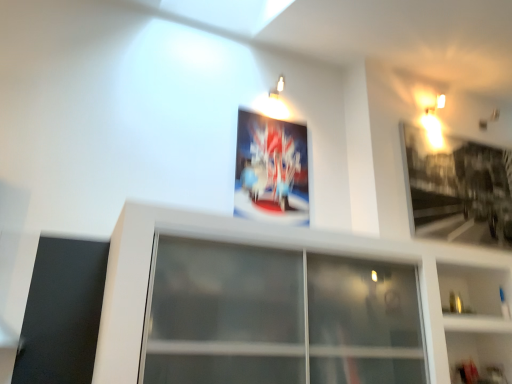
Measure the distance between metallic silver picture frame at upper right, which is the 2th picture frame in left-to-right order, and camera.

metallic silver picture frame at upper right, which is the 2th picture frame in left-to-right order, and camera are 10.36 feet apart.

Locate an element on the screen. The image size is (512, 384). metallic silver picture frame at upper right, which is the 2th picture frame in left-to-right order is located at coordinates (459, 190).

How much space does metallic poster at center, which is counted as the first picture frame, starting from the left, occupy vertically?

metallic poster at center, which is counted as the first picture frame, starting from the left, is 36.17 inches tall.

Identify the location of transparent glass window at center. Image resolution: width=512 pixels, height=384 pixels. (279, 317).

Is transparent glass window at center facing away from metallic poster at center, which is counted as the first picture frame, starting from the left?

No.

Who is shorter, transparent glass window at center or metallic poster at center, which is counted as the first picture frame, starting from the left?

With less height is transparent glass window at center.

Which is in front, transparent glass window at center or metallic poster at center, which is the second picture frame in right-to-left order?

transparent glass window at center is in front.

From the image's perspective, is white glossy shelf at lower right beneath metallic poster at center, which is the second picture frame in right-to-left order?

Yes.

Is white glossy shelf at lower right thinner than metallic poster at center, which is the second picture frame in right-to-left order?

No, white glossy shelf at lower right is not thinner than metallic poster at center, which is the second picture frame in right-to-left order.

Between white glossy shelf at lower right and metallic poster at center, which is counted as the first picture frame, starting from the left, which one has more height?

Standing taller between the two is metallic poster at center, which is counted as the first picture frame, starting from the left.

Are white glossy shelf at lower right and metallic poster at center, which is counted as the first picture frame, starting from the left, far apart?

Indeed, white glossy shelf at lower right is not near metallic poster at center, which is counted as the first picture frame, starting from the left.

In the image, is white glossy shelf at lower right positioned in front of or behind transparent glass window at center?

white glossy shelf at lower right is positioned farther from the viewer than transparent glass window at center.

Could you tell me if white glossy shelf at lower right is facing transparent glass window at center?

No, white glossy shelf at lower right is not turned towards transparent glass window at center.

From the image's perspective, which is above, white glossy shelf at lower right or transparent glass window at center?

transparent glass window at center appears higher in the image.

Which object is more forward, metallic poster at center, which is the second picture frame in right-to-left order, or white glossy shelf at lower right?

white glossy shelf at lower right is closer to the camera.

Looking at this image, considering the relative sizes of metallic poster at center, which is counted as the first picture frame, starting from the left, and white glossy shelf at lower right in the image provided, is metallic poster at center, which is counted as the first picture frame, starting from the left, wider than white glossy shelf at lower right?

No.

Can you confirm if metallic poster at center, which is the second picture frame in right-to-left order, is taller than white glossy shelf at lower right?

Correct, metallic poster at center, which is the second picture frame in right-to-left order, is much taller as white glossy shelf at lower right.

From the image's perspective, is metallic poster at center, which is counted as the first picture frame, starting from the left, under white glossy shelf at lower right?

No.

Who is taller, transparent glass window at center or white glossy shelf at lower right?

With more height is white glossy shelf at lower right.

From a real-world perspective, between transparent glass window at center and white glossy shelf at lower right, who is vertically higher?

transparent glass window at center, from a real-world perspective.

Considering the points (325, 330) and (483, 359), which point is in front, point (325, 330) or point (483, 359)?

Positioned in front is point (325, 330).

From the image's perspective, is transparent glass window at center on white glossy shelf at lower right?

Yes, from the image's perspective, transparent glass window at center is above white glossy shelf at lower right.

Considering the relative sizes of metallic silver picture frame at upper right, which is the 2th picture frame in left-to-right order, and metallic poster at center, which is counted as the first picture frame, starting from the left, in the image provided, is metallic silver picture frame at upper right, which is the 2th picture frame in left-to-right order, bigger than metallic poster at center, which is counted as the first picture frame, starting from the left,?

Correct, metallic silver picture frame at upper right, which is the 2th picture frame in left-to-right order, is larger in size than metallic poster at center, which is counted as the first picture frame, starting from the left.

Which is closer to the camera, (425, 143) or (291, 162)?

Point (425, 143) is farther from the camera than point (291, 162).

How far apart are metallic silver picture frame at upper right, the 1th picture frame viewed from the right, and metallic poster at center, which is counted as the first picture frame, starting from the left?

They are 1.18 meters apart.

Consider the image. In the image, is metallic silver picture frame at upper right, which is the 2th picture frame in left-to-right order, positioned in front of or behind metallic poster at center, which is counted as the first picture frame, starting from the left?

Clearly, metallic silver picture frame at upper right, which is the 2th picture frame in left-to-right order, is behind metallic poster at center, which is counted as the first picture frame, starting from the left.

Who is more distant, white glossy shelf at lower right or metallic silver picture frame at upper right, which is the 2th picture frame in left-to-right order?

metallic silver picture frame at upper right, which is the 2th picture frame in left-to-right order.

Is white glossy shelf at lower right completely or partially outside of metallic silver picture frame at upper right, the 1th picture frame viewed from the right?

Indeed, white glossy shelf at lower right is completely outside metallic silver picture frame at upper right, the 1th picture frame viewed from the right.

Who is shorter, white glossy shelf at lower right or metallic silver picture frame at upper right, the 1th picture frame viewed from the right?

white glossy shelf at lower right.

From a real-world perspective, which is physically above, white glossy shelf at lower right or metallic silver picture frame at upper right, the 1th picture frame viewed from the right?

metallic silver picture frame at upper right, the 1th picture frame viewed from the right, from a real-world perspective.

From a real-world perspective, count 2nd picture frames upward from the transparent glass window at center and point to it. Please provide its 2D coordinates.

[(271, 170)]

At what (x,y) coordinates should I click in order to perform the action: click on shelf in front of the metallic poster at center, which is the second picture frame in right-to-left order. Please return your answer as a coordinate pair (x, y). Looking at the image, I should click on (477, 317).

From the image, which object appears to be nearer to metallic silver picture frame at upper right, the 1th picture frame viewed from the right, metallic poster at center, which is counted as the first picture frame, starting from the left, or white glossy shelf at lower right?

The object closer to metallic silver picture frame at upper right, the 1th picture frame viewed from the right, is white glossy shelf at lower right.

Considering their positions, is metallic silver picture frame at upper right, which is the 2th picture frame in left-to-right order, positioned closer to metallic poster at center, which is the second picture frame in right-to-left order, than transparent glass window at center?

The object closer to metallic poster at center, which is the second picture frame in right-to-left order, is transparent glass window at center.

Estimate the real-world distances between objects in this image. Which object is closer to metallic silver picture frame at upper right, the 1th picture frame viewed from the right, metallic poster at center, which is counted as the first picture frame, starting from the left, or transparent glass window at center?

Among the two, metallic poster at center, which is counted as the first picture frame, starting from the left, is located nearer to metallic silver picture frame at upper right, the 1th picture frame viewed from the right.

Based on their spatial positions, is transparent glass window at center or metallic silver picture frame at upper right, which is the 2th picture frame in left-to-right order, closer to white glossy shelf at lower right?

Among the two, metallic silver picture frame at upper right, which is the 2th picture frame in left-to-right order, is located nearer to white glossy shelf at lower right.

Which object lies nearer to the anchor point white glossy shelf at lower right, metallic silver picture frame at upper right, the 1th picture frame viewed from the right, or metallic poster at center, which is counted as the first picture frame, starting from the left?

Among the two, metallic silver picture frame at upper right, the 1th picture frame viewed from the right, is located nearer to white glossy shelf at lower right.

Considering their positions, is metallic poster at center, which is counted as the first picture frame, starting from the left, positioned closer to white glossy shelf at lower right than transparent glass window at center?

Based on the image, transparent glass window at center appears to be nearer to white glossy shelf at lower right.

Based on the photo, considering their positions, is transparent glass window at center positioned closer to metallic poster at center, which is counted as the first picture frame, starting from the left, than white glossy shelf at lower right?

transparent glass window at center.

From the image, which object appears to be nearer to metallic silver picture frame at upper right, which is the 2th picture frame in left-to-right order, transparent glass window at center or metallic poster at center, which is the second picture frame in right-to-left order?

metallic poster at center, which is the second picture frame in right-to-left order, lies closer to metallic silver picture frame at upper right, which is the 2th picture frame in left-to-right order, than the other object.

Locate an element on the screen. Image resolution: width=512 pixels, height=384 pixels. picture frame situated between transparent glass window at center and white glossy shelf at lower right from left to right is located at coordinates (271, 170).

Image resolution: width=512 pixels, height=384 pixels. I want to click on picture frame between transparent glass window at center and metallic silver picture frame at upper right, which is the 2th picture frame in left-to-right order, from left to right, so click(x=271, y=170).

The image size is (512, 384). In order to click on shelf located between transparent glass window at center and metallic silver picture frame at upper right, the 1th picture frame viewed from the right, in the left-right direction in this screenshot , I will do `click(477, 317)`.

The height and width of the screenshot is (384, 512). Identify the location of shelf between metallic poster at center, which is counted as the first picture frame, starting from the left, and metallic silver picture frame at upper right, which is the 2th picture frame in left-to-right order, in the horizontal direction. (477, 317).